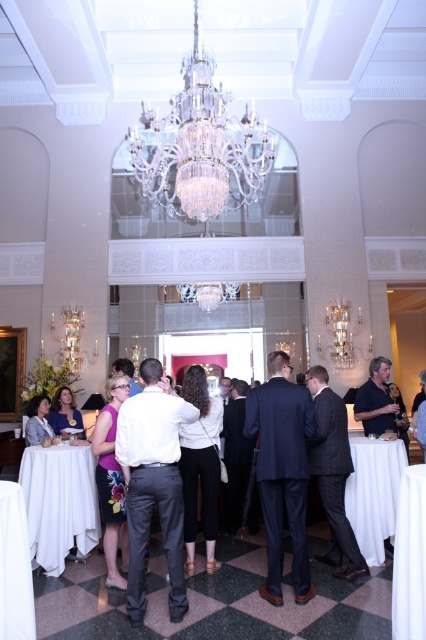
Question: Is white cloth at lower right closer to the viewer compared to white cloth table at lower left?

Choices:
 (A) no
 (B) yes

Answer: (A)

Question: Does clear crystal chandelier at center appear under light gray suit at center?

Choices:
 (A) yes
 (B) no

Answer: (B)

Question: Estimate the real-world distances between objects in this image. Which object is closer to the white fabric table at lower right?

Choices:
 (A) matte black shirt at right
 (B) white cloth at lower right

Answer: (B)

Question: Which point appears closest to the camera in this image?

Choices:
 (A) (367, 484)
 (B) (408, 570)

Answer: (B)

Question: Which of these objects is positioned farthest from the white fabric table at lower right?

Choices:
 (A) light gray suit at center
 (B) clear crystal chandelier at center
 (C) dark gray pinstripe suit at center

Answer: (B)

Question: Is white cloth table at lower left above matte purple dress at center?

Choices:
 (A) no
 (B) yes

Answer: (A)